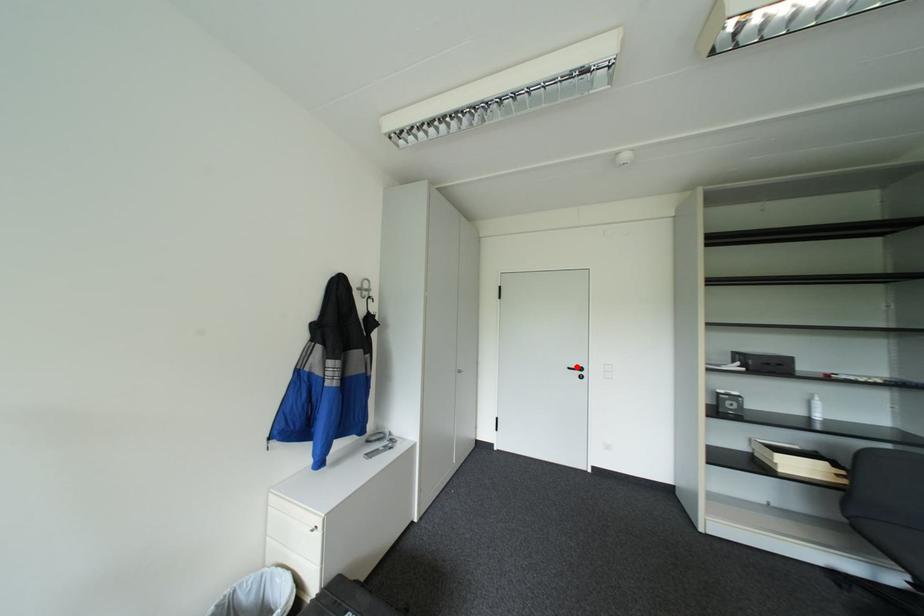
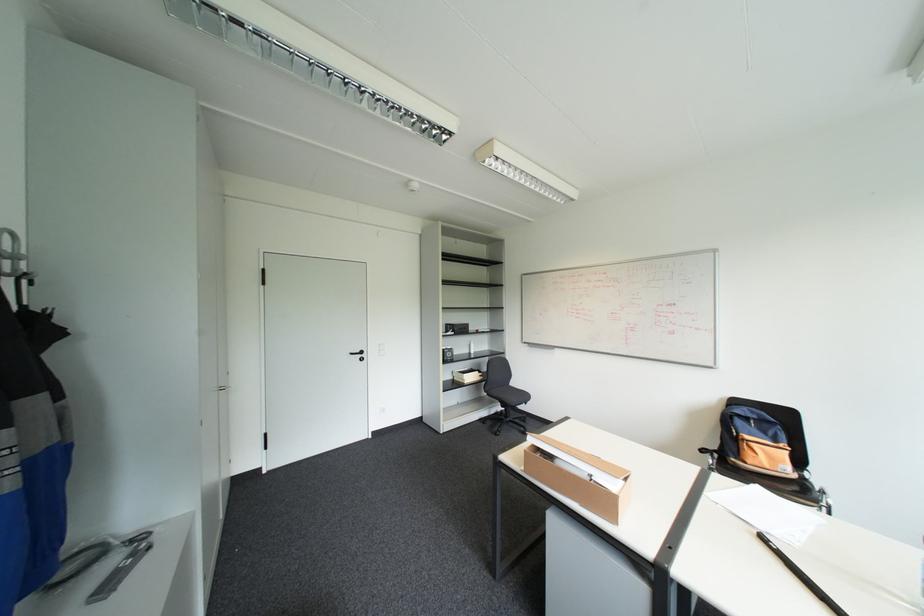
Find the pixel in the second image that matches the highlighted location in the first image.

(359, 353)